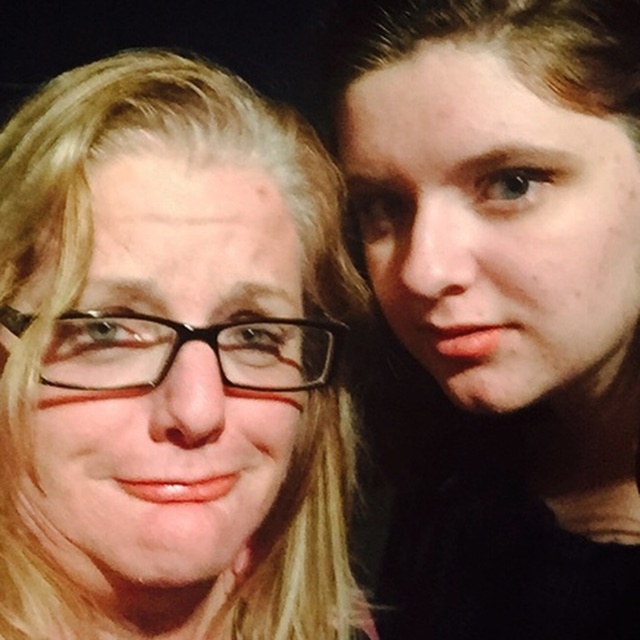
You are a photographer adjusting the lighting for a portrait. You notice the smooth skin face at right in the image. Based on the scene description, where should you position the key light to best illuminate this face?

The smooth skin face at right is located at point (x=509, y=300). To best illuminate this face, position the key light slightly above and to the side opposite the face, considering the existing shadows cast by the current lighting.

You are a photographer adjusting the lighting in a dimly lit room where two people are sitting. You need to ensure that both the smooth skin face at right and the black plastic glasses at left are well illuminated. Based on their positions, which object should you adjust the light to focus on first?

The smooth skin face at right is located below the black plastic glasses at left, so you should adjust the light to focus on the black plastic glasses at left first to ensure proper illumination of both objects.

Looking at this image, you are a photographer adjusting the framing for a portrait. You need to ensure both the smooth skin face at right and the black plastic glasses at left fit within the camera frame. Based on their widths, which object requires more horizontal space in the frame?

The smooth skin face at right requires more horizontal space in the frame because it might be wider than the black plastic glasses at left.